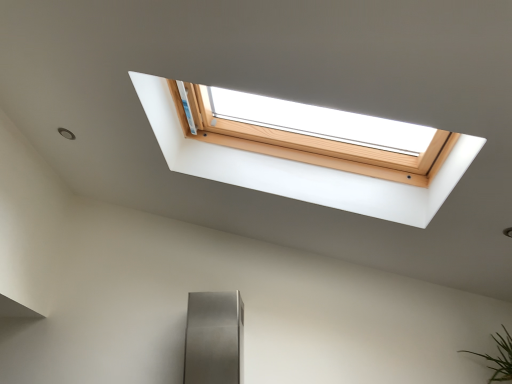
Question: Should I look upward or downward to see green leafy plant at lower right?

Choices:
 (A) up
 (B) down

Answer: (B)